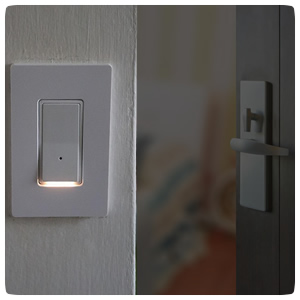
What are the coordinates of `door handle` in the screenshot? It's located at (256, 147).